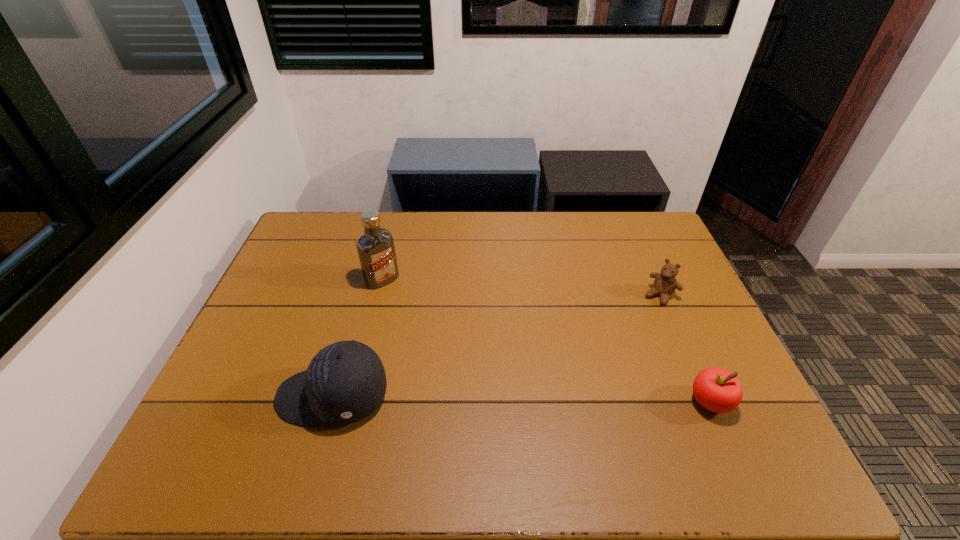
Where is `free space located on the front-facing side of the vodka`? This screenshot has width=960, height=540. free space located on the front-facing side of the vodka is located at coordinates (460, 357).

In order to click on vacant space situated 0.120m on the front-facing side of the teddy bear in this screenshot , I will do `click(635, 327)`.

This screenshot has width=960, height=540. Identify the location of vacant point located 0.280m on the front-facing side of the teddy bear. (606, 362).

In order to click on vacant space located on the front-facing side of the teddy bear in this screenshot , I will do `click(615, 350)`.

Where is `baseball cap located in the near edge section of the desktop`? The height and width of the screenshot is (540, 960). baseball cap located in the near edge section of the desktop is located at coordinates (345, 382).

The width and height of the screenshot is (960, 540). In order to click on apple positioned at the near edge in this screenshot , I will do `click(716, 389)`.

Find the location of `object that is at the left edge`. object that is at the left edge is located at coordinates (345, 382).

The image size is (960, 540). Find the location of `apple located in the right edge section of the desktop`. apple located in the right edge section of the desktop is located at coordinates (716, 389).

You are a GUI agent. You are given a task and a screenshot of the screen. Output one action in this format:
    pyautogui.click(x=<x>, y=<y>)
    Task: Click on the teddy bear that is at the right edge
    The height and width of the screenshot is (540, 960).
    Given the screenshot: What is the action you would take?
    pyautogui.click(x=665, y=283)

The width and height of the screenshot is (960, 540). I want to click on object at the near left corner, so click(x=345, y=382).